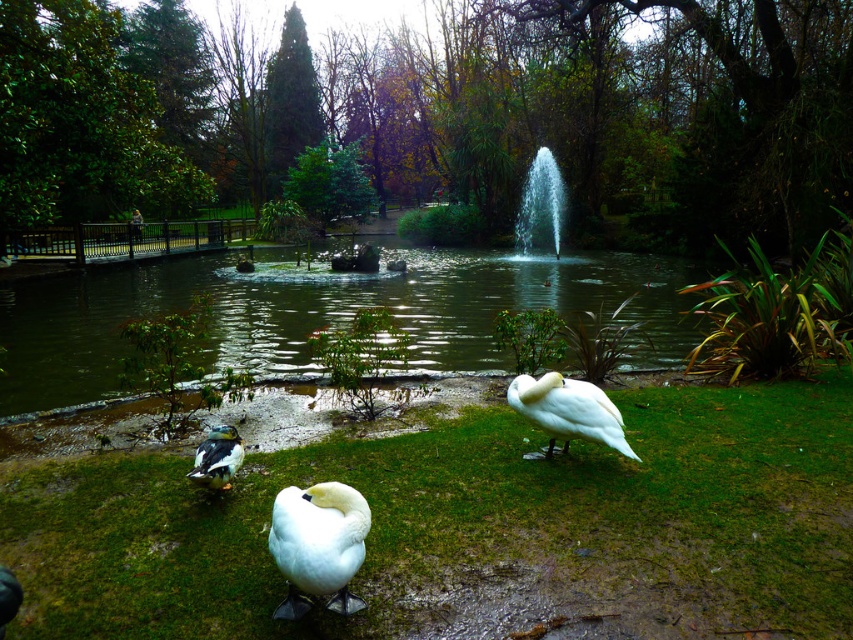
From the picture: Is green grass at lower center above white glossy swan at center?

No.

Is point (527, 448) behind point (602, 435)?

Yes, it is behind point (602, 435).

Which is behind, point (740, 467) or point (532, 420)?

The point (740, 467) is more distant.

The width and height of the screenshot is (853, 640). In order to click on green grass at lower center in this screenshot , I will do `click(473, 529)`.

In the scene shown: Who is higher up, green grassy lake at center or greenish-blue glossy duck at lower left?

green grassy lake at center is above.

Is point (480, 285) more distant than point (215, 426)?

Yes, point (480, 285) is farther from viewer.

The height and width of the screenshot is (640, 853). What do you see at coordinates (323, 310) in the screenshot? I see `green grassy lake at center` at bounding box center [323, 310].

Identify the location of green grassy lake at center. The height and width of the screenshot is (640, 853). (323, 310).

Who is taller, white glossy swan at center or brushed metal bench at left?

Standing taller between the two is brushed metal bench at left.

Is white glossy swan at center thinner than brushed metal bench at left?

Correct, white glossy swan at center's width is less than brushed metal bench at left's.

Locate an element on the screen. This screenshot has width=853, height=640. white glossy swan at center is located at coordinates (567, 410).